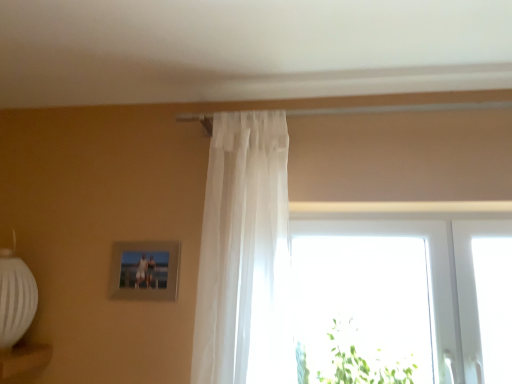
Question: Could you tell me if green leafy plant at lower right is turned towards transparent glass window at center?

Choices:
 (A) no
 (B) yes

Answer: (A)

Question: Does green leafy plant at lower right have a greater height compared to transparent glass window at center?

Choices:
 (A) no
 (B) yes

Answer: (A)

Question: Is green leafy plant at lower right positioned behind transparent glass window at center?

Choices:
 (A) no
 (B) yes

Answer: (A)

Question: From the image's perspective, does green leafy plant at lower right appear lower than transparent glass window at center?

Choices:
 (A) no
 (B) yes

Answer: (B)

Question: From a real-world perspective, is green leafy plant at lower right on transparent glass window at center?

Choices:
 (A) no
 (B) yes

Answer: (A)

Question: Is green leafy plant at lower right looking in the opposite direction of transparent glass window at center?

Choices:
 (A) no
 (B) yes

Answer: (B)

Question: Can you confirm if sheer white curtain at center is shorter than green leafy plant at lower right?

Choices:
 (A) yes
 (B) no

Answer: (B)

Question: From the image's perspective, is sheer white curtain at center under green leafy plant at lower right?

Choices:
 (A) yes
 (B) no

Answer: (B)

Question: Are sheer white curtain at center and green leafy plant at lower right located far from each other?

Choices:
 (A) no
 (B) yes

Answer: (A)

Question: Considering the relative sizes of sheer white curtain at center and green leafy plant at lower right in the image provided, is sheer white curtain at center smaller than green leafy plant at lower right?

Choices:
 (A) yes
 (B) no

Answer: (B)

Question: Could green leafy plant at lower right be considered to be inside sheer white curtain at center?

Choices:
 (A) no
 (B) yes

Answer: (A)

Question: Is sheer white curtain at center positioned with its back to green leafy plant at lower right?

Choices:
 (A) no
 (B) yes

Answer: (A)

Question: Is metallic silver picture frame at upper left positioned in front of sheer white curtain at center?

Choices:
 (A) no
 (B) yes

Answer: (A)